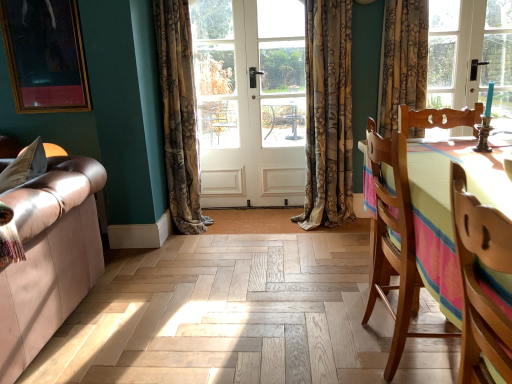
Question: Considering the relative sizes of gold-framed portrait at upper left and wooden chair at right, the second chair viewed from the back, in the image provided, is gold-framed portrait at upper left wider than wooden chair at right, the second chair viewed from the back,?

Choices:
 (A) yes
 (B) no

Answer: (B)

Question: Is gold-framed portrait at upper left in front of wooden chair at right, the second chair viewed from the back?

Choices:
 (A) yes
 (B) no

Answer: (B)

Question: Is gold-framed portrait at upper left directly adjacent to wooden chair at right, placed as the first chair when sorted from front to back?

Choices:
 (A) yes
 (B) no

Answer: (B)

Question: Is gold-framed portrait at upper left taller than wooden chair at right, placed as the first chair when sorted from front to back?

Choices:
 (A) yes
 (B) no

Answer: (A)

Question: Is wooden chair at right, the second chair viewed from the back, completely or partially inside gold-framed portrait at upper left?

Choices:
 (A) yes
 (B) no

Answer: (B)

Question: Considering their positions, is wooden chair at right, the second chair viewed from the back, located in front of or behind white wooden screen door at center?

Choices:
 (A) front
 (B) behind

Answer: (A)

Question: Based on their positions, is wooden chair at right, placed as the first chair when sorted from front to back, located to the left or right of white wooden screen door at center?

Choices:
 (A) right
 (B) left

Answer: (A)

Question: From the image's perspective, is wooden chair at right, placed as the first chair when sorted from front to back, positioned above or below white wooden screen door at center?

Choices:
 (A) below
 (B) above

Answer: (A)

Question: Is wooden chair at right, placed as the first chair when sorted from front to back, inside or outside of white wooden screen door at center?

Choices:
 (A) outside
 (B) inside

Answer: (A)

Question: Considering the positions of gold-framed portrait at upper left and floral fabric curtain at center, the 1th curtain in the left-to-right sequence, in the image, is gold-framed portrait at upper left wider or thinner than floral fabric curtain at center, the 1th curtain in the left-to-right sequence,?

Choices:
 (A) thin
 (B) wide

Answer: (A)

Question: In terms of height, does gold-framed portrait at upper left look taller or shorter compared to floral fabric curtain at center, the second curtain when ordered from right to left?

Choices:
 (A) tall
 (B) short

Answer: (B)

Question: From the image's perspective, relative to floral fabric curtain at center, the second curtain when ordered from right to left, is gold-framed portrait at upper left above or below?

Choices:
 (A) above
 (B) below

Answer: (A)

Question: Is point (14, 36) closer or farther from the camera than point (187, 183)?

Choices:
 (A) farther
 (B) closer

Answer: (A)

Question: Does point (498, 263) appear closer or farther from the camera than point (412, 238)?

Choices:
 (A) farther
 (B) closer

Answer: (B)

Question: From the image's perspective, is wooden chair at right, placed as the first chair when sorted from front to back, above or below wooden chair at right, the first chair positioned from the back?

Choices:
 (A) above
 (B) below

Answer: (B)